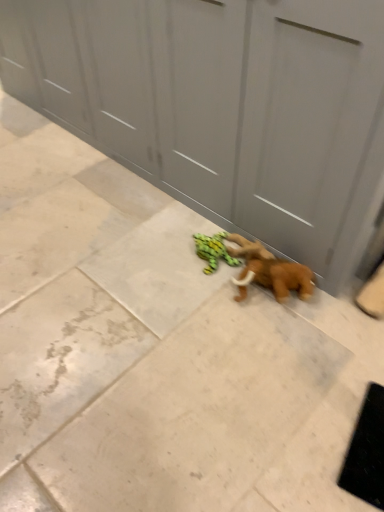
Find the location of a particular element. This screenshot has height=512, width=384. vacant area that is in front of brown plush elephant at lower center is located at coordinates (288, 349).